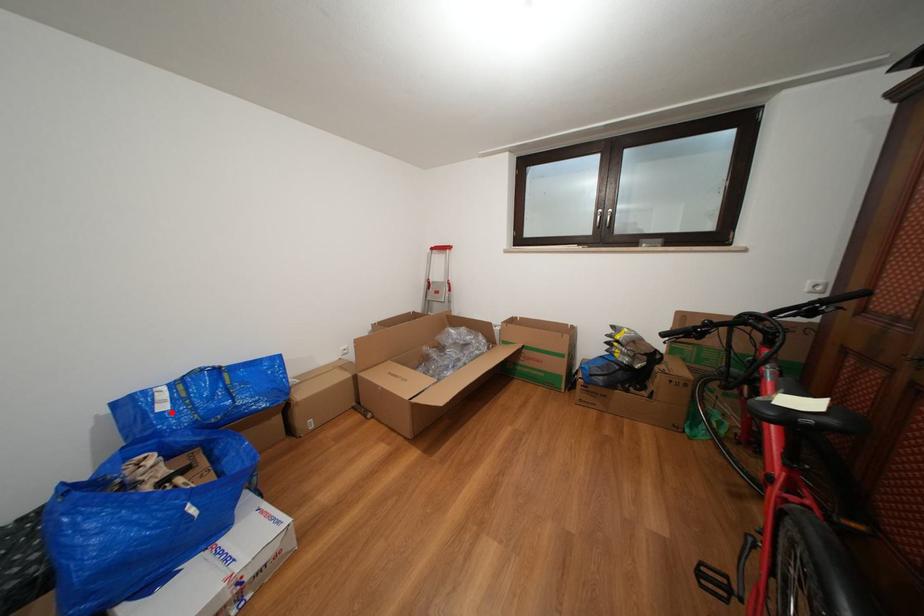
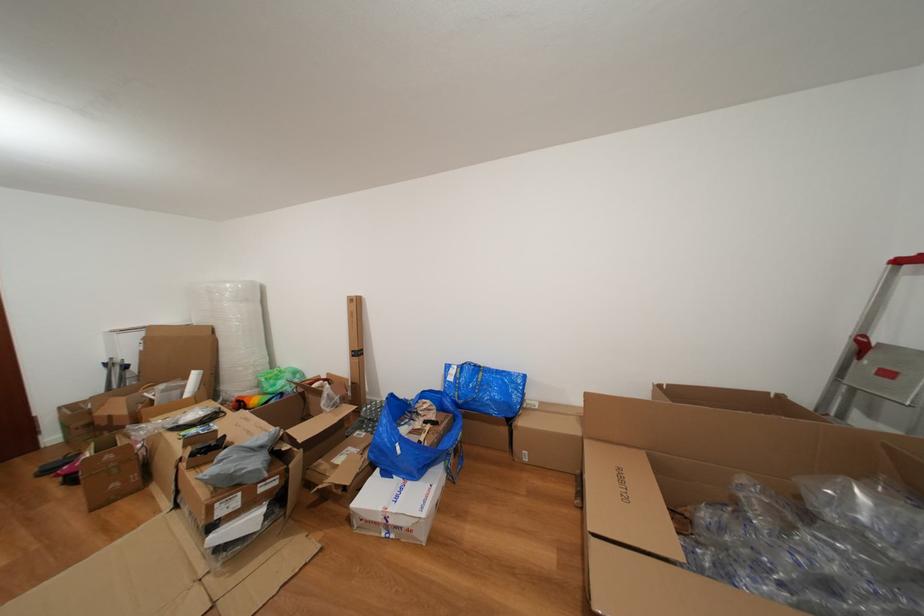
Question: I am providing you with two images of the same scene from different viewpoints. Given a red point in image1, look at the same physical point in image2. Is it:

Choices:
 (A) Closer to the viewpoint
 (B) Farther from the viewpoint

Answer: (B)